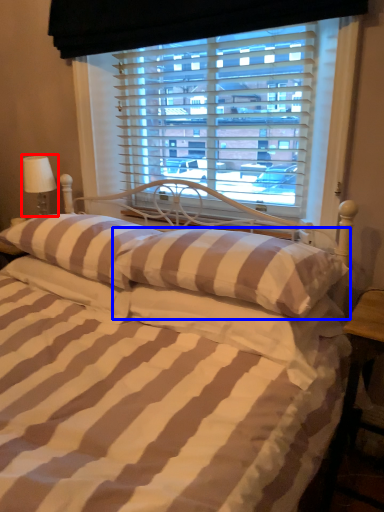
Question: Which object is closer to the camera taking this photo, table lamp (highlighted by a red box) or pillow (highlighted by a blue box)?

Choices:
 (A) table lamp
 (B) pillow

Answer: (B)